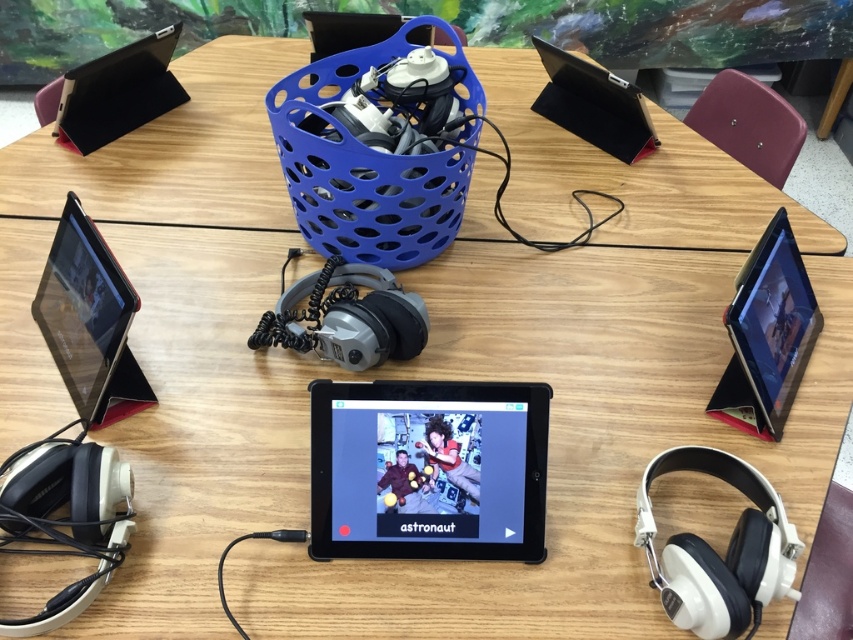
Question: Does matte black tablet at center appear under white matte headphones at lower right?

Choices:
 (A) yes
 (B) no

Answer: (B)

Question: Based on their relative distances, which object is farther from the matte black tablet at left?

Choices:
 (A) blue plastic basket at center
 (B) black matte tablet at right

Answer: (B)

Question: Does blue plastic basket at center have a smaller size compared to black matte tablet at right?

Choices:
 (A) no
 (B) yes

Answer: (A)

Question: Based on their relative distances, which object is farther from the matte black tablet at center?

Choices:
 (A) black matte tablet at right
 (B) blue plastic basket at center
 (C) white matte headphones at lower right

Answer: (B)

Question: Where is matte black tablet at center located in relation to black matte tablet at right in the image?

Choices:
 (A) right
 (B) left

Answer: (B)

Question: Which object is farther from the camera taking this photo?

Choices:
 (A) matte black tablet at center
 (B) matte black tablet at left

Answer: (B)